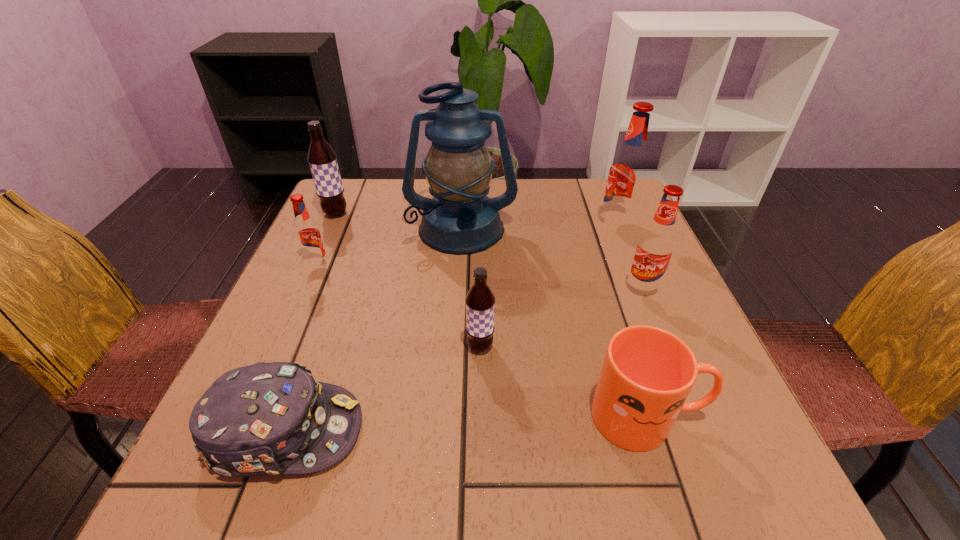
Find the location of `the right brown root beer`. the right brown root beer is located at coordinates (480, 301).

This screenshot has width=960, height=540. Identify the location of mug. (647, 374).

Locate an element on the screen. orange mug is located at coordinates (647, 374).

Identify the location of headwear. (267, 418).

Locate an element on the screen. This screenshot has height=540, width=960. free space located 0.080m on the face of the lantern is located at coordinates (459, 279).

Where is `vacant region located on the front of the biggest red root beer`? vacant region located on the front of the biggest red root beer is located at coordinates (636, 275).

The image size is (960, 540). Find the location of `vacant space located on the right of the farther brown root beer`. vacant space located on the right of the farther brown root beer is located at coordinates (388, 214).

Identify the location of vacant area located 0.270m on the front of the nearest red root beer. This screenshot has width=960, height=540. (696, 421).

Locate an element on the screen. The height and width of the screenshot is (540, 960). vacant space located on the back of the fourth farthest object is located at coordinates (337, 223).

You are a GUI agent. You are given a task and a screenshot of the screen. Output one action in this format:
    pyautogui.click(x=<x>, y=<y>)
    Task: Click on the free space located on the left of the nearer brown root beer
    This screenshot has height=540, width=960.
    Given the screenshot: What is the action you would take?
    tap(433, 347)